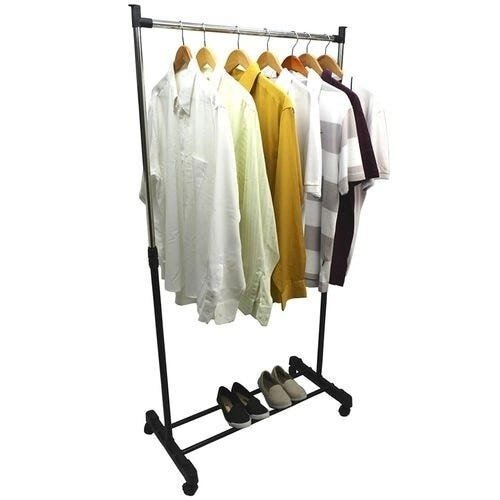
The width and height of the screenshot is (500, 500). Identify the location of shoes on rack. (241, 415), (252, 407), (278, 395), (293, 388).